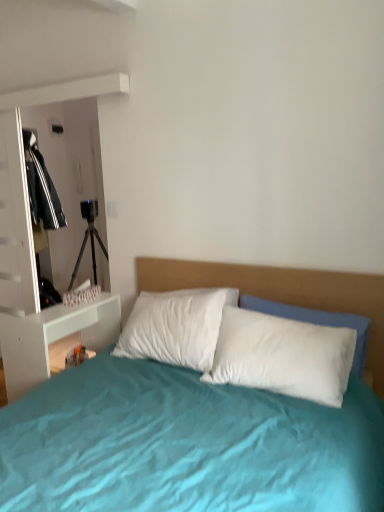
Image resolution: width=384 pixels, height=512 pixels. In order to click on white soft pillow at center in this screenshot , I will do pyautogui.click(x=283, y=356).

Describe the element at coordinates (283, 356) in the screenshot. The width and height of the screenshot is (384, 512). I see `white soft pillow at center` at that location.

What is the approximate width of white soft pillow at center?

The width of white soft pillow at center is 28.36 centimeters.

The height and width of the screenshot is (512, 384). I want to click on white glossy nightstand at left, so click(x=53, y=338).

What do you see at coordinates (53, 338) in the screenshot? The width and height of the screenshot is (384, 512). I see `white glossy nightstand at left` at bounding box center [53, 338].

What are the coordinates of `white soft pillow at center` in the screenshot? It's located at (283, 356).

Considering the positions of objects white glossy nightstand at left and white soft pillow at center in the image provided, who is more to the left, white glossy nightstand at left or white soft pillow at center?

From the viewer's perspective, white glossy nightstand at left appears more on the left side.

Is white glossy nightstand at left in front of white soft pillow at center?

No, white glossy nightstand at left is further to the viewer.

Considering the points (100, 339) and (229, 365), which point is in front, point (100, 339) or point (229, 365)?

Point (229, 365)

From the image's perspective, would you say white glossy nightstand at left is shown under white soft pillow at center?

Indeed, from the image's perspective, white glossy nightstand at left is shown beneath white soft pillow at center.

From a real-world perspective, relative to white soft pillow at center, is white glossy nightstand at left vertically above or below?

From a real-world perspective, white glossy nightstand at left is physically below white soft pillow at center.

Considering the sizes of objects white glossy nightstand at left and white soft pillow at center in the image provided, who is thinner, white glossy nightstand at left or white soft pillow at center?

white soft pillow at center.

Does white glossy nightstand at left have a greater height compared to white soft pillow at center?

Yes.

Based on their sizes in the image, would you say white glossy nightstand at left is bigger or smaller than white soft pillow at center?

Clearly, white glossy nightstand at left is larger in size than white soft pillow at center.

Is white glossy nightstand at left not inside white soft pillow at center?

Yes.

Would you say white glossy nightstand at left is a long distance from white soft pillow at center?

That's right, there is a large distance between white glossy nightstand at left and white soft pillow at center.

Is white glossy nightstand at left oriented away from white soft pillow at center?

Yes, white glossy nightstand at left's orientation is away from white soft pillow at center.

You are a GUI agent. You are given a task and a screenshot of the screen. Output one action in this format:
    pyautogui.click(x=<x>, y=<y>)
    Task: Click on the nightstand behind the white soft pillow at center
    This screenshot has width=384, height=512.
    Given the screenshot: What is the action you would take?
    pyautogui.click(x=53, y=338)

Is white soft pillow at center to the left of white glossy nightstand at left from the viewer's perspective?

No.

Consider the image. Considering their positions, is white soft pillow at center located in front of or behind white glossy nightstand at left?

Visually, white soft pillow at center is located in front of white glossy nightstand at left.

Does point (297, 374) lie in front of point (6, 320)?

Yes, it is in front of point (6, 320).

From the image's perspective, is white soft pillow at center located beneath white glossy nightstand at left?

No, from the image's perspective, white soft pillow at center is not beneath white glossy nightstand at left.

From a real-world perspective, which is physically above, white soft pillow at center or white glossy nightstand at left?

From a 3D spatial view, white soft pillow at center is above.

Can you confirm if white soft pillow at center is thinner than white glossy nightstand at left?

Yes, white soft pillow at center is thinner than white glossy nightstand at left.

Between white soft pillow at center and white glossy nightstand at left, which one has more height?

white glossy nightstand at left is taller.

Is white soft pillow at center bigger or smaller than white glossy nightstand at left?

Considering their sizes, white soft pillow at center takes up less space than white glossy nightstand at left.

Is white soft pillow at center surrounding white glossy nightstand at left?

No, white glossy nightstand at left is not a part of white soft pillow at center.

Is white soft pillow at center placed right next to white glossy nightstand at left?

No, white soft pillow at center is not next to white glossy nightstand at left.

Is white soft pillow at center oriented towards white glossy nightstand at left?

No, white soft pillow at center is not oriented towards white glossy nightstand at left.

Can you tell me how much white soft pillow at center and white glossy nightstand at left differ in facing direction?

They differ by 85.7 degrees in their facing directions.

Locate an element on the screen. The width and height of the screenshot is (384, 512). nightstand below the white soft pillow at center (from the image's perspective) is located at coordinates (53, 338).

Where is `nightstand behind the white soft pillow at center`? The height and width of the screenshot is (512, 384). nightstand behind the white soft pillow at center is located at coordinates (53, 338).

I want to click on pillow above the white glossy nightstand at left (from a real-world perspective), so click(283, 356).